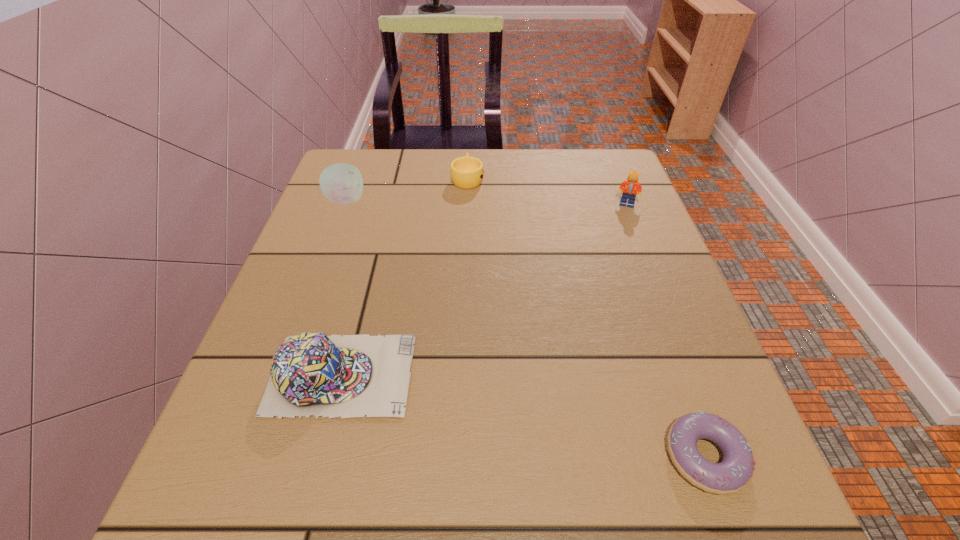
Where is `vacant space that satisfies the following two spatial constraints: 1. on the front, side, and top of the third tallest object; 2. on the right side of the doughnut`? This screenshot has height=540, width=960. vacant space that satisfies the following two spatial constraints: 1. on the front, side, and top of the third tallest object; 2. on the right side of the doughnut is located at coordinates (321, 457).